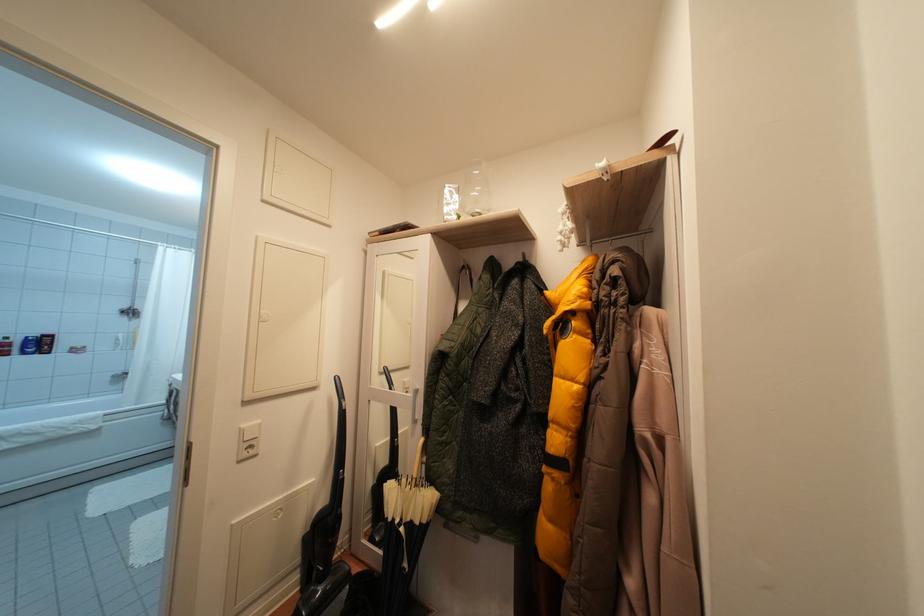
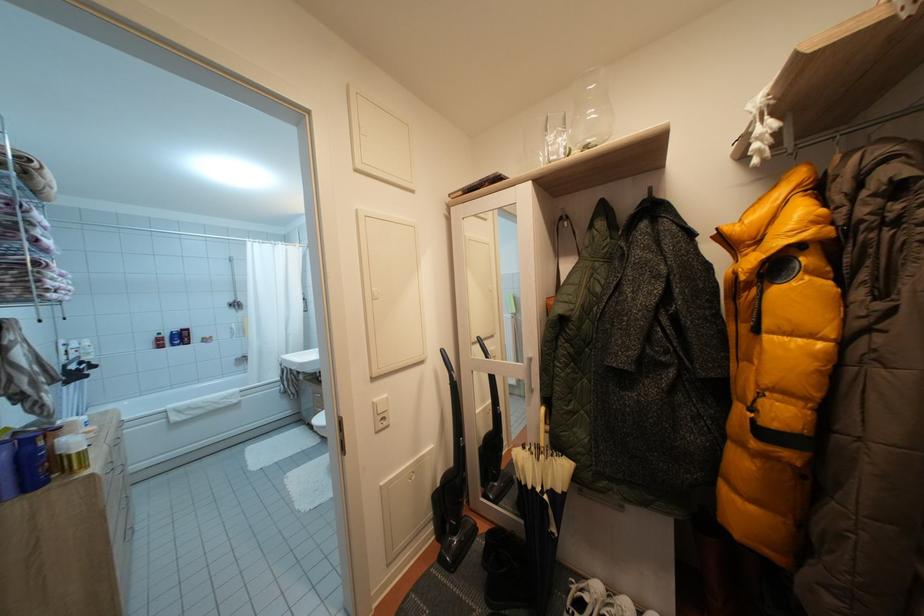
Question: The camera is either moving clockwise (left) or counter-clockwise (right) around the object. The first image is from the beginning of the video and the second image is from the end. Is the camera moving left or right when shooting the video?

Choices:
 (A) Left
 (B) Right

Answer: (B)